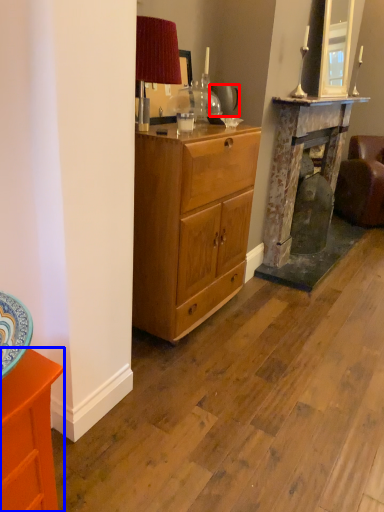
Question: Among these objects, which one is farthest to the camera, teapot (highlighted by a red box) or cabinetry (highlighted by a blue box)?

Choices:
 (A) teapot
 (B) cabinetry

Answer: (A)